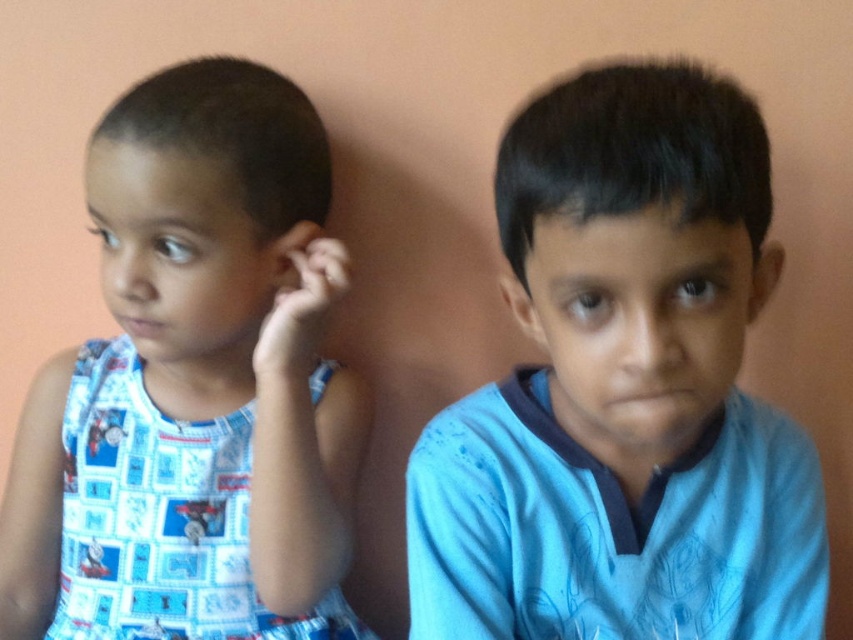
Question: Estimate the real-world distances between objects in this image. Which object is farther from the blue printed dress at left?

Choices:
 (A) smooth skin ear at center
 (B) blue cotton shirt at center

Answer: (A)

Question: Which is nearer to the matte skin ear at right?

Choices:
 (A) blue cotton shirt at right
 (B) blue printed dress at left

Answer: (A)

Question: Estimate the real-world distances between objects in this image. Which object is farther from the blue printed dress at left?

Choices:
 (A) blue cotton shirt at center
 (B) smooth skin ear at center

Answer: (B)

Question: Can you confirm if blue cotton shirt at center is smaller than blue printed dress at left?

Choices:
 (A) yes
 (B) no

Answer: (A)

Question: Is blue printed dress at left further to the viewer compared to matte skin ear at right?

Choices:
 (A) yes
 (B) no

Answer: (A)

Question: Is blue printed dress at left smaller than blue cotton shirt at right?

Choices:
 (A) yes
 (B) no

Answer: (B)